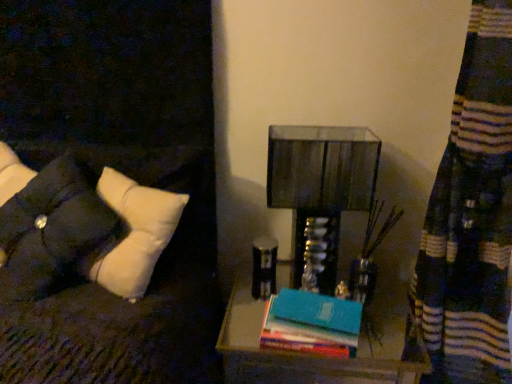
You are a GUI agent. You are given a task and a screenshot of the screen. Output one action in this format:
    pyautogui.click(x=<x>, y=<y>)
    Task: Click on the teal matte book at center
    The image size is (512, 384).
    Given the screenshot: What is the action you would take?
    tap(312, 324)

Describe the element at coordinates (312, 324) in the screenshot. This screenshot has height=384, width=512. I see `teal matte book at center` at that location.

Image resolution: width=512 pixels, height=384 pixels. Identify the location of tufted fabric pillow at left. (53, 230).

Describe the element at coordinates (53, 230) in the screenshot. I see `tufted fabric pillow at left` at that location.

The image size is (512, 384). What do you see at coordinates (126, 301) in the screenshot? I see `white fabric pillow at left` at bounding box center [126, 301].

Identify the location of metallic glass table lamp at center. pos(321,183).

Who is bigger, tufted fabric pillow at left or metallic glass table lamp at center?

tufted fabric pillow at left.

Considering their positions, is tufted fabric pillow at left located in front of or behind metallic glass table lamp at center?

tufted fabric pillow at left is in front of metallic glass table lamp at center.

Can you confirm if tufted fabric pillow at left is positioned to the right of metallic glass table lamp at center?

Incorrect, tufted fabric pillow at left is not on the right side of metallic glass table lamp at center.

Is point (265, 362) closer or farther from the camera than point (144, 336)?

Point (265, 362) appears to be farther away from the viewer than point (144, 336).

How different are the orientations of wooden nightstand at lower right and white fabric pillow at left in degrees?

21.2 degrees separate the facing orientations of wooden nightstand at lower right and white fabric pillow at left.

In the image, is wooden nightstand at lower right positioned in front of or behind white fabric pillow at left?

Clearly, wooden nightstand at lower right is behind white fabric pillow at left.

Considering the relative sizes of wooden nightstand at lower right and white fabric pillow at left in the image provided, is wooden nightstand at lower right smaller than white fabric pillow at left?

No, wooden nightstand at lower right is not smaller than white fabric pillow at left.

Locate an element on the screen. book located on the right of tufted fabric pillow at left is located at coordinates pos(312,324).

Based on the photo, can you confirm if tufted fabric pillow at left is smaller than teal matte book at center?

No, tufted fabric pillow at left is not smaller than teal matte book at center.

Is teal matte book at center at the back of tufted fabric pillow at left?

No, teal matte book at center is not at the back of tufted fabric pillow at left.

From a real-world perspective, which is physically above, tufted fabric pillow at left or teal matte book at center?

tufted fabric pillow at left, from a real-world perspective.

Is teal matte book at center further to the viewer compared to tufted fabric pillow at left?

No, it is in front of tufted fabric pillow at left.

Locate an element on the screen. pillow behind the teal matte book at center is located at coordinates (53, 230).

Which of these two, teal matte book at center or tufted fabric pillow at left, is smaller?

teal matte book at center is smaller.

What's the angular difference between teal matte book at center and tufted fabric pillow at left's facing directions?

They differ by 1.1 degrees in their facing directions.

Is tufted fabric pillow at left inside the boundaries of wooden nightstand at lower right, or outside?

tufted fabric pillow at left is not inside wooden nightstand at lower right, it's outside.

Can you confirm if tufted fabric pillow at left is taller than wooden nightstand at lower right?

No, tufted fabric pillow at left is not taller than wooden nightstand at lower right.

Is point (71, 252) farther from camera compared to point (308, 358)?

No, (71, 252) is closer to viewer.

In the scene shown: From the image's perspective, which one is positioned higher, tufted fabric pillow at left or wooden nightstand at lower right?

tufted fabric pillow at left.

In the scene shown: How distant is white fabric pillow at left from metallic glass table lamp at center?

white fabric pillow at left and metallic glass table lamp at center are 15.16 inches apart.

From a real-world perspective, is white fabric pillow at left physically below metallic glass table lamp at center?

No, from a real-world perspective, white fabric pillow at left is not below metallic glass table lamp at center.

There is a metallic glass table lamp at center. Identify the location of furniture above it (from a real-world perspective). (126, 301).

Consider the image. Would you say white fabric pillow at left is inside or outside metallic glass table lamp at center?

white fabric pillow at left is outside metallic glass table lamp at center.

Considering the positions of objects metallic glass table lamp at center and teal matte book at center in the image provided, who is more to the right, metallic glass table lamp at center or teal matte book at center?

metallic glass table lamp at center.

Could you tell me if metallic glass table lamp at center is turned towards teal matte book at center?

Yes, metallic glass table lamp at center is turned towards teal matte book at center.

In order to click on book in front of the metallic glass table lamp at center in this screenshot , I will do `click(312, 324)`.

Based on the photo, is metallic glass table lamp at center touching teal matte book at center?

No.

At what (x,y) coordinates should I click in order to perform the action: click on table lamp below the tufted fabric pillow at left (from a real-world perspective). Please return your answer as a coordinate pair (x, y). Looking at the image, I should click on (321, 183).

You are a GUI agent. You are given a task and a screenshot of the screen. Output one action in this format:
    pyautogui.click(x=<x>, y=<y>)
    Task: Click on the nightstand on the right of white fabric pillow at left
    The width and height of the screenshot is (512, 384).
    Given the screenshot: What is the action you would take?
    pyautogui.click(x=305, y=354)

When comparing their distances from metallic glass table lamp at center, does tufted fabric pillow at left or teal matte book at center seem closer?

Based on the image, teal matte book at center appears to be nearer to metallic glass table lamp at center.

Consider the image. Estimate the real-world distances between objects in this image. Which object is closer to teal matte book at center, tufted fabric pillow at left or wooden nightstand at lower right?

The object closer to teal matte book at center is wooden nightstand at lower right.

Estimate the real-world distances between objects in this image. Which object is further from white fabric pillow at left, wooden nightstand at lower right or metallic glass table lamp at center?

The object further to white fabric pillow at left is metallic glass table lamp at center.

Looking at the image, which one is located further to teal matte book at center, tufted fabric pillow at left or white fabric pillow at left?

tufted fabric pillow at left is positioned further to the anchor teal matte book at center.

Looking at this image, from the image, which object appears to be nearer to metallic glass table lamp at center, teal matte book at center or white fabric pillow at left?

The object closer to metallic glass table lamp at center is teal matte book at center.

Which object lies further to the anchor point tufted fabric pillow at left, teal matte book at center or wooden nightstand at lower right?

Among the two, wooden nightstand at lower right is located further to tufted fabric pillow at left.

Based on their spatial positions, is tufted fabric pillow at left or metallic glass table lamp at center further from wooden nightstand at lower right?

tufted fabric pillow at left.

Estimate the real-world distances between objects in this image. Which object is closer to white fabric pillow at left, teal matte book at center or metallic glass table lamp at center?

Among the two, teal matte book at center is located nearer to white fabric pillow at left.

The height and width of the screenshot is (384, 512). In order to click on book that lies between metallic glass table lamp at center and wooden nightstand at lower right from top to bottom in this screenshot , I will do `click(312, 324)`.

Find the location of a particular element. This screenshot has width=512, height=384. nightstand situated between tufted fabric pillow at left and metallic glass table lamp at center from left to right is located at coordinates (305, 354).

This screenshot has height=384, width=512. What are the coordinates of `furniture between tufted fabric pillow at left and wooden nightstand at lower right in the horizontal direction` in the screenshot? It's located at (126, 301).

Locate an element on the screen. The height and width of the screenshot is (384, 512). book between white fabric pillow at left and wooden nightstand at lower right from left to right is located at coordinates (312, 324).